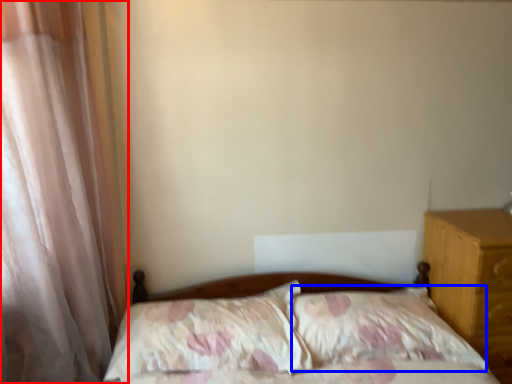
Question: Which point is closer to the camera, curtain (highlighted by a red box) or pillow (highlighted by a blue box)?

Choices:
 (A) curtain
 (B) pillow

Answer: (A)